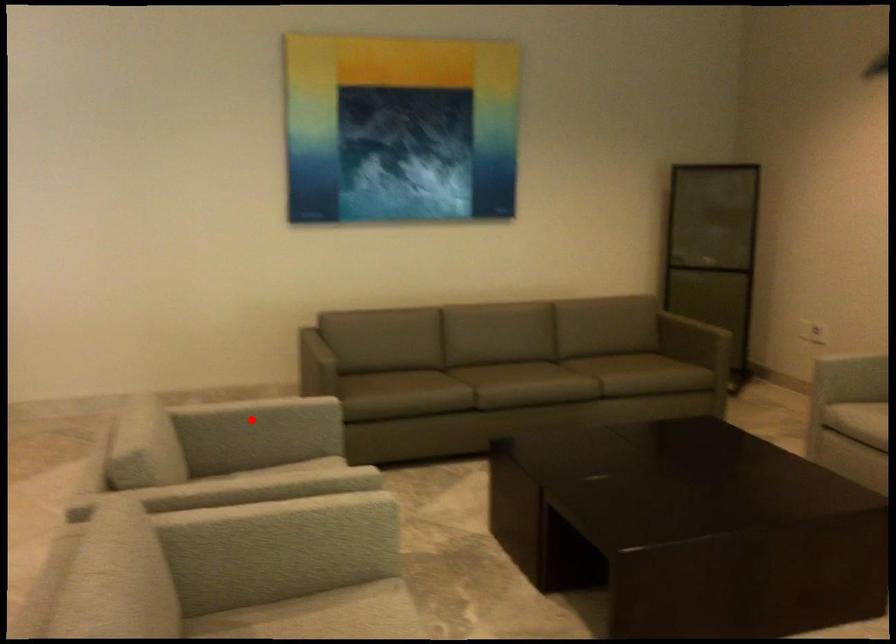
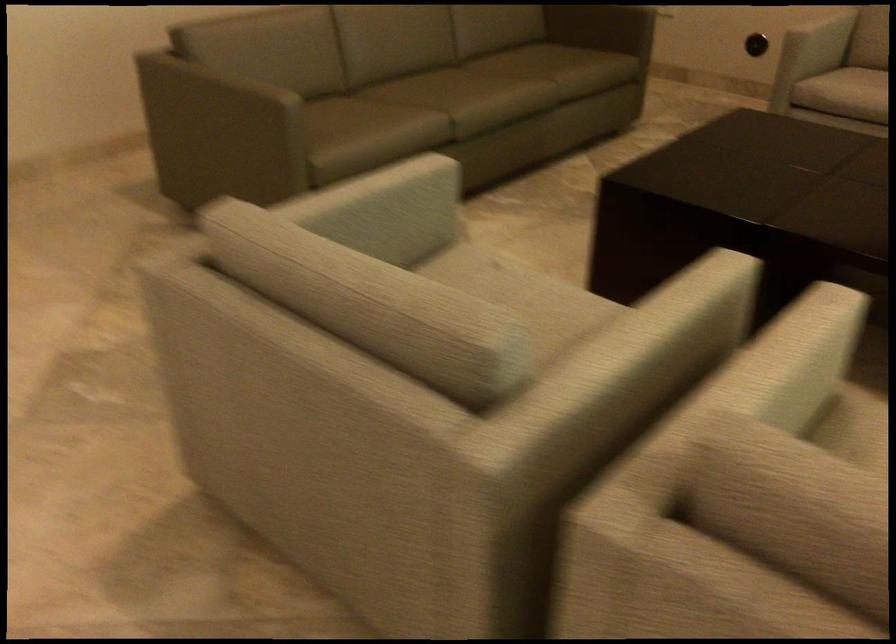
Question: I am providing you with two images of the same scene from different viewpoints. Given a red point in image1, look at the same physical point in image2. Is it:

Choices:
 (A) Closer to the viewpoint
 (B) Farther from the viewpoint

Answer: (A)